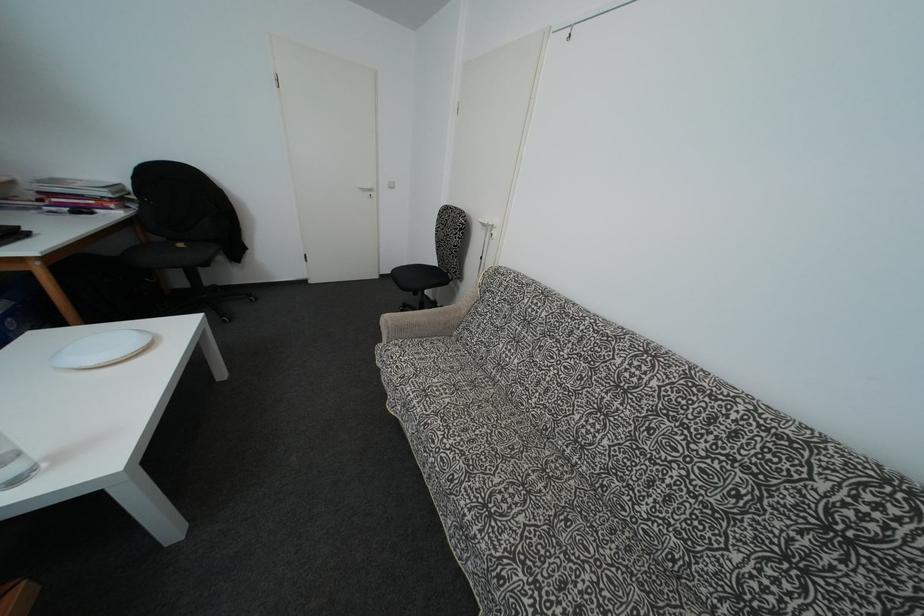
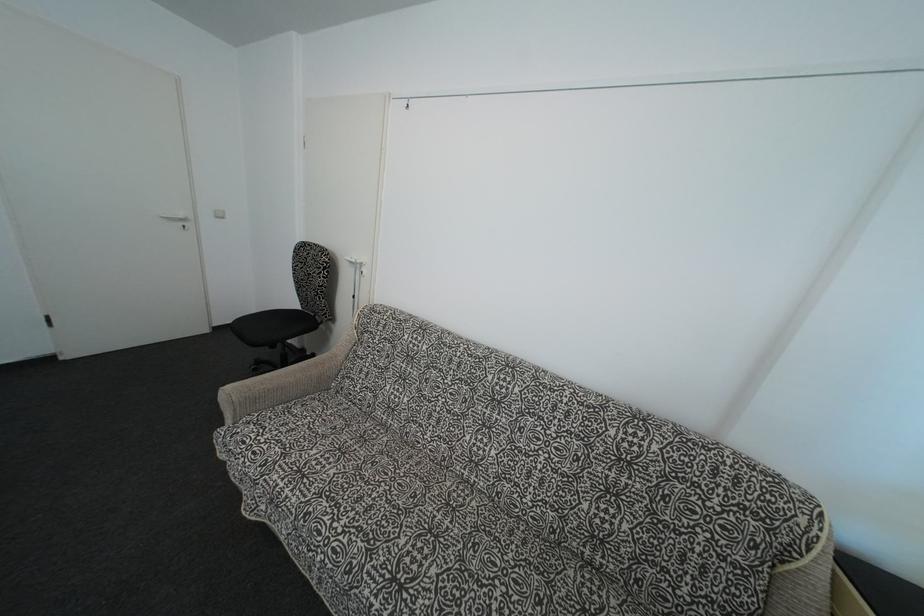
In the second image, find the point that corresponds to (392,326) in the first image.

(235, 399)